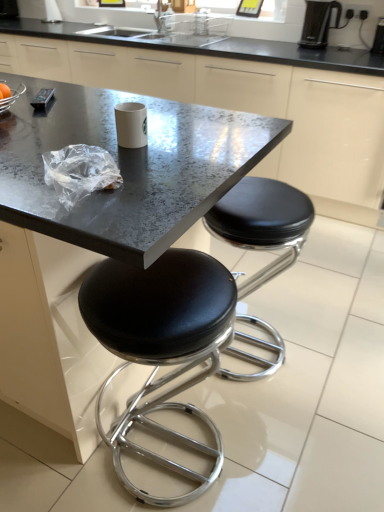
In order to click on free space to the left of white glossy paper cup at center in this screenshot , I will do `click(76, 132)`.